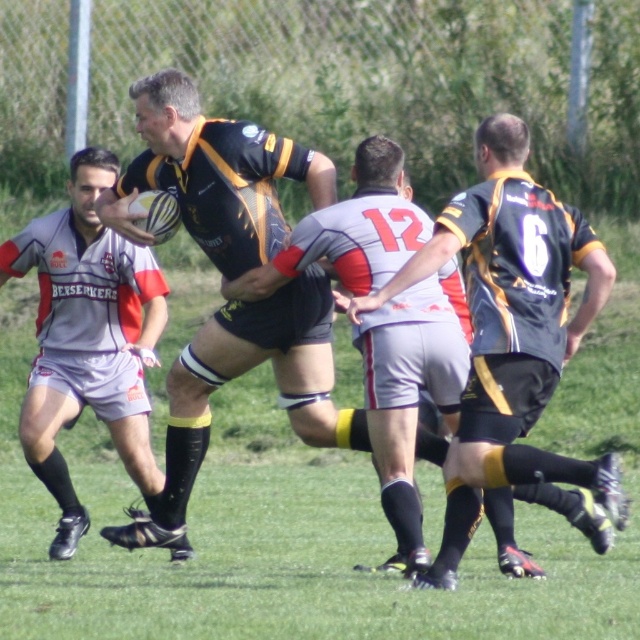
Question: Which point appears closest to the camera in this image?

Choices:
 (A) (x=548, y=376)
 (B) (x=131, y=253)
 (C) (x=324, y=408)

Answer: (A)

Question: Which point is farther to the camera?

Choices:
 (A) (500, 305)
 (B) (163, 314)
 (C) (195, 198)

Answer: (B)

Question: Is the position of matte black rugby ball at center less distant than that of matte black rugby ball at left?

Choices:
 (A) no
 (B) yes

Answer: (B)

Question: Based on their relative distances, which object is nearer to the matte black rugby ball at center?

Choices:
 (A) matte black jersey at center
 (B) matte black rugby ball at left

Answer: (A)

Question: Observing the image, what is the correct spatial positioning of matte black rugby ball at center in reference to matte black rugby ball at left?

Choices:
 (A) below
 (B) above

Answer: (B)

Question: Is matte black rugby ball at center wider than matte black jersey at center?

Choices:
 (A) no
 (B) yes

Answer: (B)